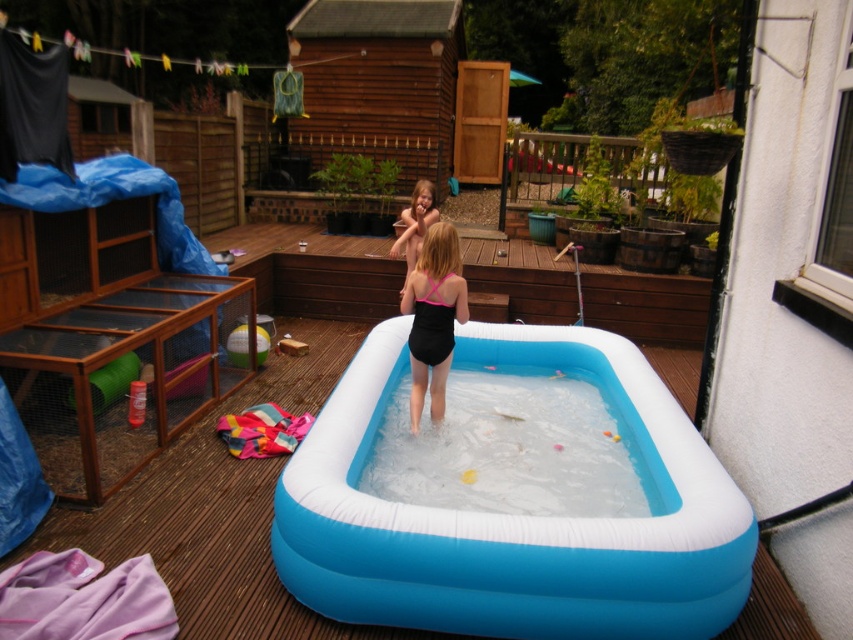
Between blue inflatable pool at center and pink matte swimsuit at center, which one is positioned lower?

blue inflatable pool at center is below.

Consider the image. Can you confirm if blue inflatable pool at center is taller than pink matte swimsuit at center?

Correct, blue inflatable pool at center is much taller as pink matte swimsuit at center.

At what (x,y) coordinates should I click in order to perform the action: click on blue inflatable pool at center. Please return your answer as a coordinate pair (x, y). The width and height of the screenshot is (853, 640). Looking at the image, I should click on (514, 515).

Between black matte swimsuit at center and pink matte swimsuit at center, which one is positioned lower?

Positioned lower is black matte swimsuit at center.

Where is `black matte swimsuit at center`? black matte swimsuit at center is located at coordinates (433, 317).

Between point (477, 352) and point (428, 260), which one is positioned in front?

Point (428, 260) is in front.

Does blue inflatable pool at center have a larger size compared to black matte swimsuit at center?

Indeed, blue inflatable pool at center has a larger size compared to black matte swimsuit at center.

Who is more distant from viewer, (614, 340) or (453, 241)?

The point (614, 340) is more distant.

Find the location of a particular element. blue inflatable pool at center is located at coordinates (514, 515).